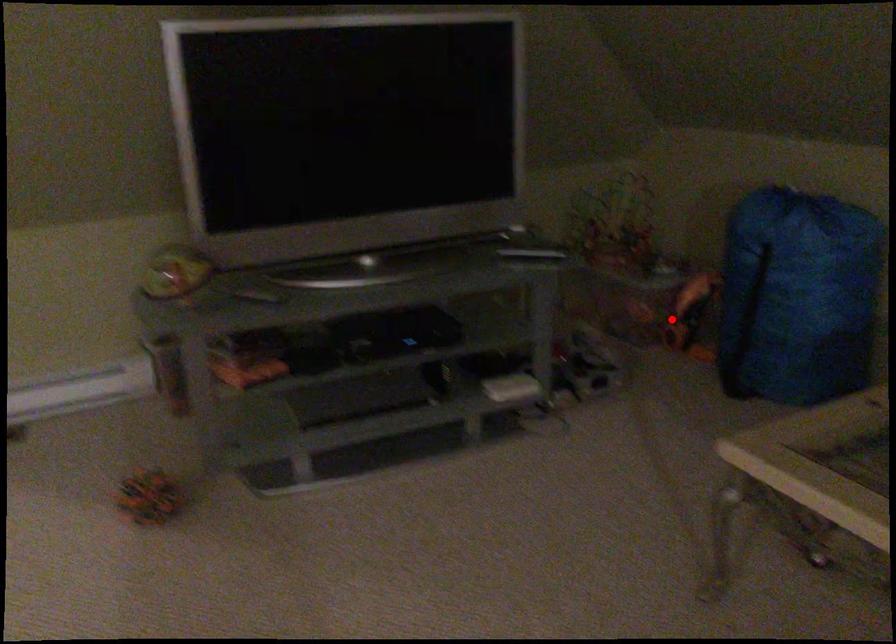
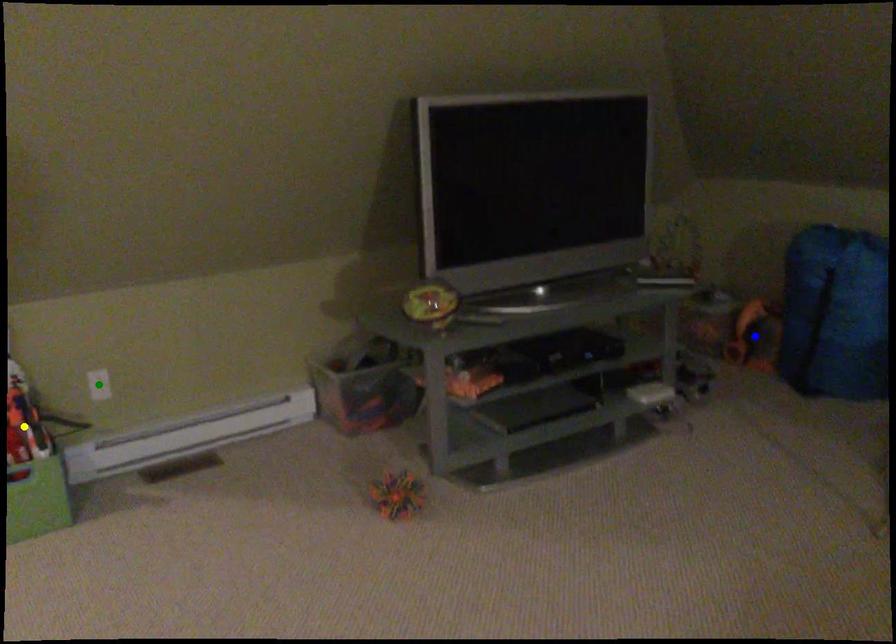
Question: I am providing you with two images of the same scene from different viewpoints. A red point is marked on the first image. You are given multiple points on the second image. In image 2, which mark is for the same physical point as the one in image 1?

Choices:
 (A) yellow point
 (B) blue point
 (C) green point

Answer: (B)